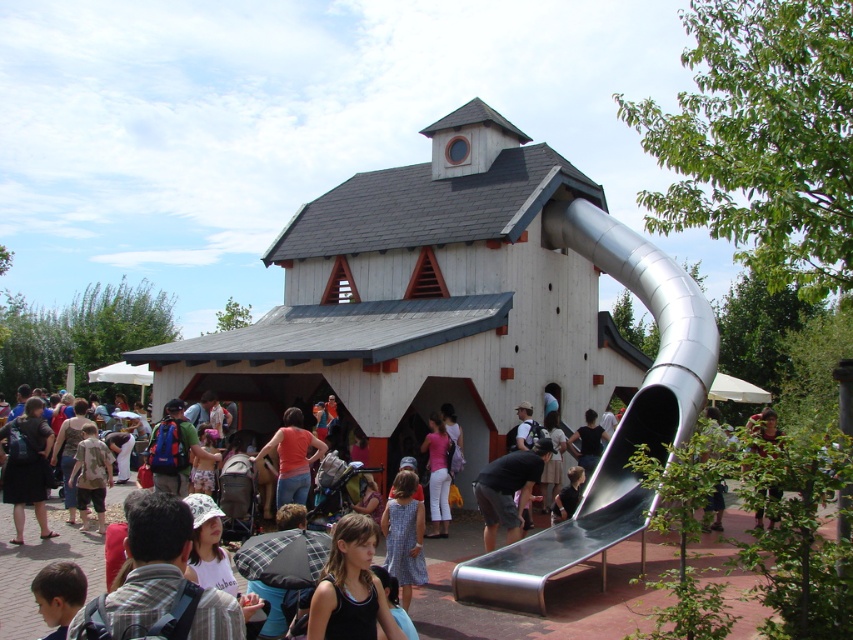
Does metallic smooth slide at right have a lesser height compared to dark gray fabric shirt at center?

No.

Is metallic smooth slide at right behind dark gray fabric shirt at center?

No, it is not.

Which is behind, point (477, 573) or point (525, 492)?

The point (525, 492) is behind.

Locate an element on the screen. metallic smooth slide at right is located at coordinates (619, 420).

Which of these two, dark gray fabric shirt at center or green leafy tree at lower right, stands taller?

Standing taller between the two is green leafy tree at lower right.

Who is lower down, dark gray fabric shirt at center or green leafy tree at lower right?

green leafy tree at lower right is below.

Is point (531, 454) less distant than point (757, 420)?

Yes, point (531, 454) is closer to viewer.

What are the coordinates of `dark gray fabric shirt at center` in the screenshot? It's located at (508, 490).

Who is more forward, (693, 348) or (778, 435)?

Point (693, 348) is more forward.

The height and width of the screenshot is (640, 853). What do you see at coordinates (619, 420) in the screenshot?
I see `metallic smooth slide at right` at bounding box center [619, 420].

Who is more forward, (544, 228) or (757, 420)?

Point (544, 228)

At what (x,y) coordinates should I click in order to perform the action: click on metallic smooth slide at right. Please return your answer as a coordinate pair (x, y). The height and width of the screenshot is (640, 853). Looking at the image, I should click on (619, 420).